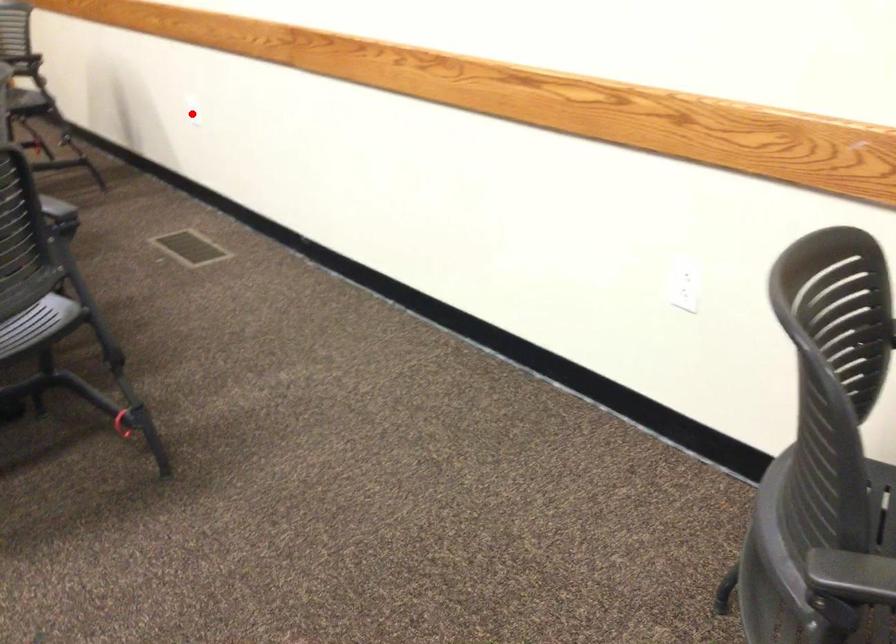
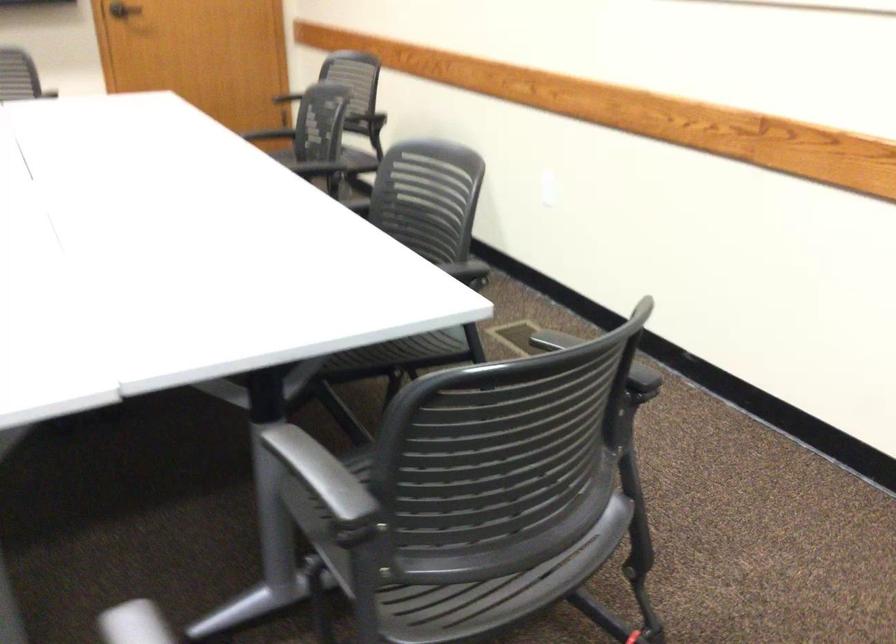
Question: I am providing you with two images of the same scene from different viewpoints. Given a red point in image1, look at the same physical point in image2. Is it:

Choices:
 (A) Closer to the viewpoint
 (B) Farther from the viewpoint

Answer: (A)